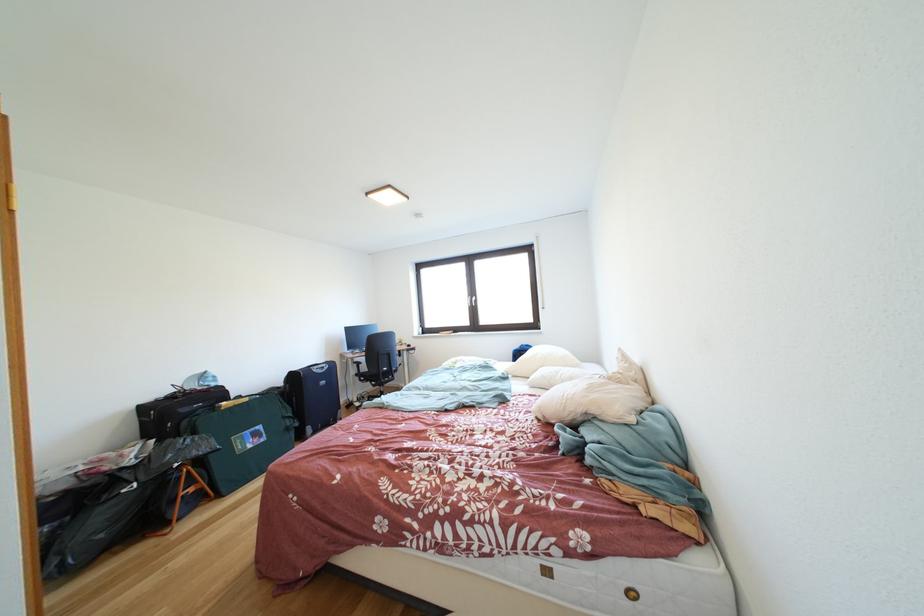
What do you see at coordinates (226, 430) in the screenshot? I see `the green bag handle` at bounding box center [226, 430].